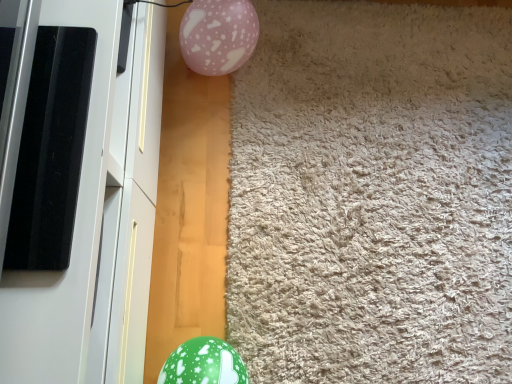
The image size is (512, 384). What are the coordinates of `free space between pink glossy balloon at upper center and beige shaggy carpet at center` in the screenshot? It's located at (216, 179).